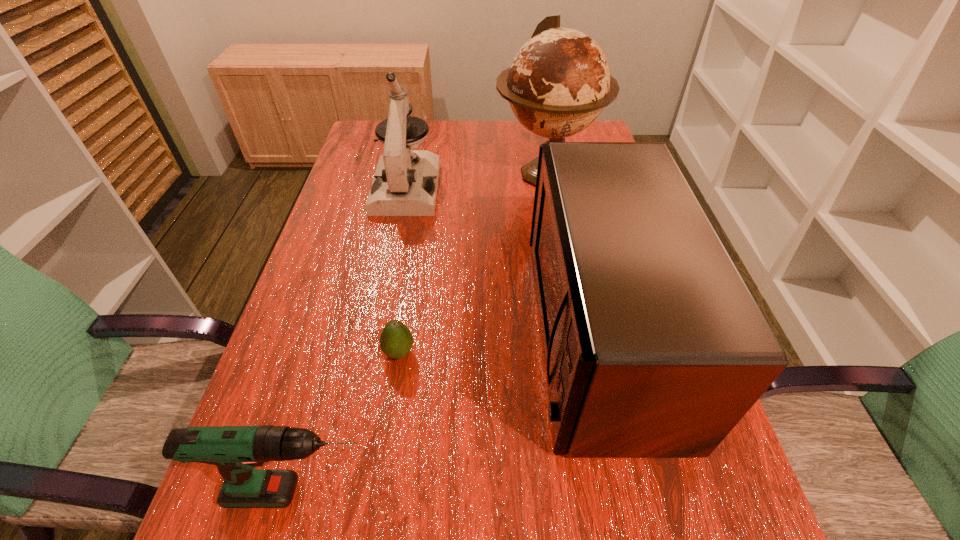
At what (x,y) coordinates should I click in order to perform the action: click on globe. Please return your answer as a coordinate pair (x, y). The width and height of the screenshot is (960, 540). Looking at the image, I should click on (559, 82).

Where is `microscope`? Image resolution: width=960 pixels, height=540 pixels. microscope is located at coordinates (405, 183).

This screenshot has height=540, width=960. Identify the location of microwave_oven. (654, 347).

Where is `the nearest object`? the nearest object is located at coordinates (236, 450).

Identify the location of the second shortest object. The height and width of the screenshot is (540, 960). (236, 450).

At what (x,y) coordinates should I click in order to perform the action: click on the shortest object. Please return your answer as a coordinate pair (x, y). This screenshot has height=540, width=960. Looking at the image, I should click on (396, 340).

You are a GUI agent. You are given a task and a screenshot of the screen. Output one action in this format:
    pyautogui.click(x=<x>, y=<y>)
    Task: Click on the free space located on the front of the tallest object showing Asia
    This screenshot has height=540, width=960.
    Given the screenshot: What is the action you would take?
    pyautogui.click(x=570, y=303)

The image size is (960, 540). Find the location of `free spot located at the eyepiece of the microscope`. free spot located at the eyepiece of the microscope is located at coordinates (383, 304).

This screenshot has width=960, height=540. Find the location of `vacant area located on the front-facing side of the microwave_oven`. vacant area located on the front-facing side of the microwave_oven is located at coordinates (484, 332).

Locate an element on the screen. The width and height of the screenshot is (960, 540). vacant region located on the front-facing side of the microwave_oven is located at coordinates (494, 332).